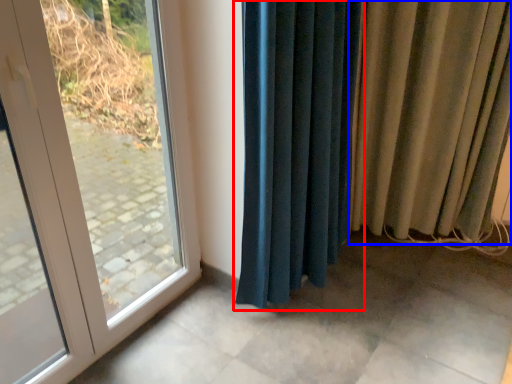
Question: Which object appears closest to the camera in this image, curtain (highlighted by a red box) or curtain (highlighted by a blue box)?

Choices:
 (A) curtain
 (B) curtain

Answer: (A)